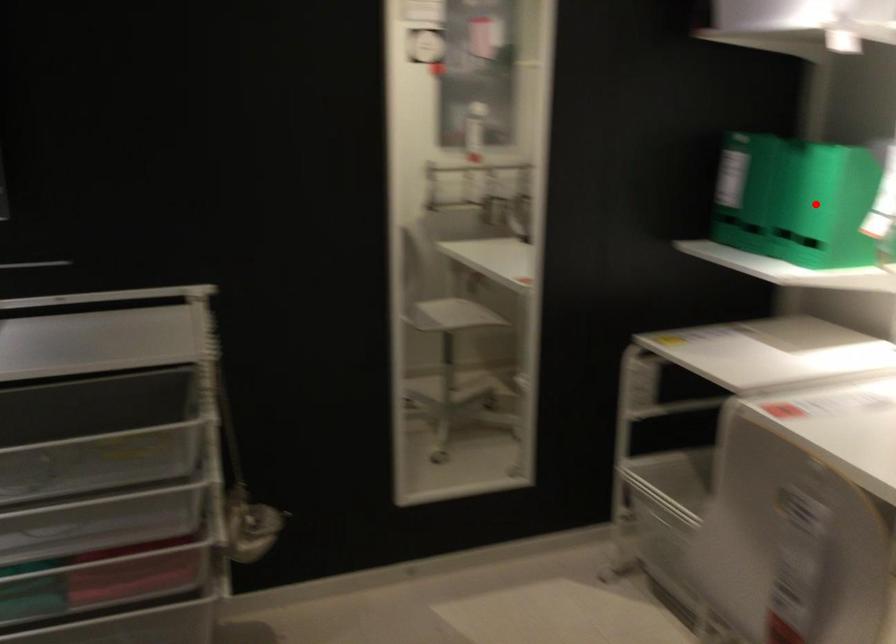
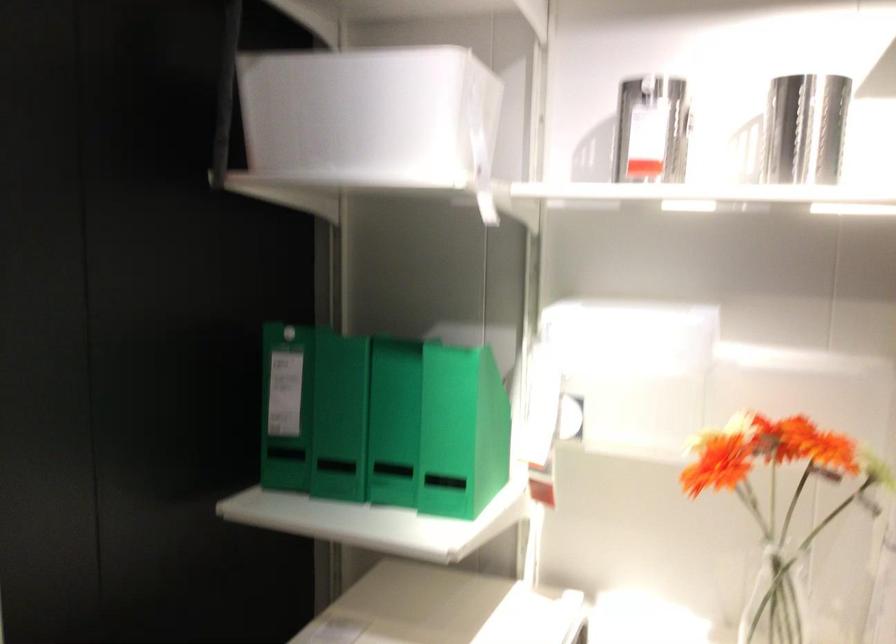
Question: I am providing you with two images of the same scene from different viewpoints. In image1, a red point is highlighted. Considering the same 3D point in image2, which of the following is correct?

Choices:
 (A) It is closer
 (B) It is farther

Answer: (A)